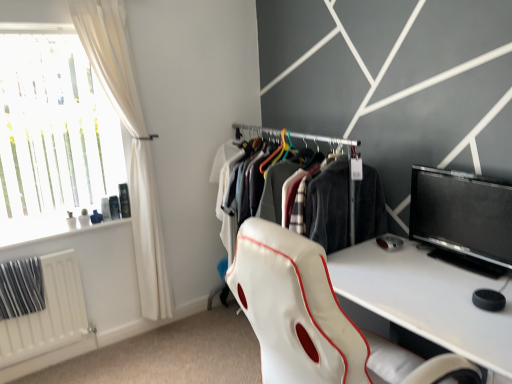
You are a GUI agent. You are given a task and a screenshot of the screen. Output one action in this format:
    pyautogui.click(x=<x>, y=<y>)
    Task: Click on the free location to the left of black glossy monitor at right
    The image size is (512, 384).
    Given the screenshot: What is the action you would take?
    pyautogui.click(x=412, y=267)